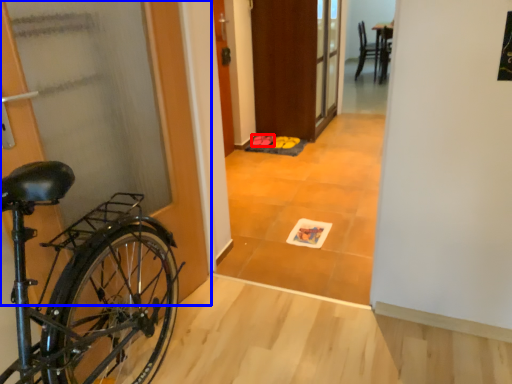
Question: Which object is closer to the camera taking this photo, footwear (highlighted by a red box) or door (highlighted by a blue box)?

Choices:
 (A) footwear
 (B) door

Answer: (B)